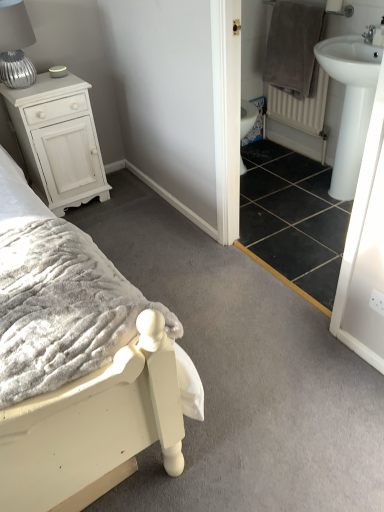
At what (x,y) coordinates should I click in order to perform the action: click on vacant space behind white glossy sink at right. Please return your answer as a coordinate pair (x, y). This screenshot has width=384, height=512. Looking at the image, I should click on (316, 281).